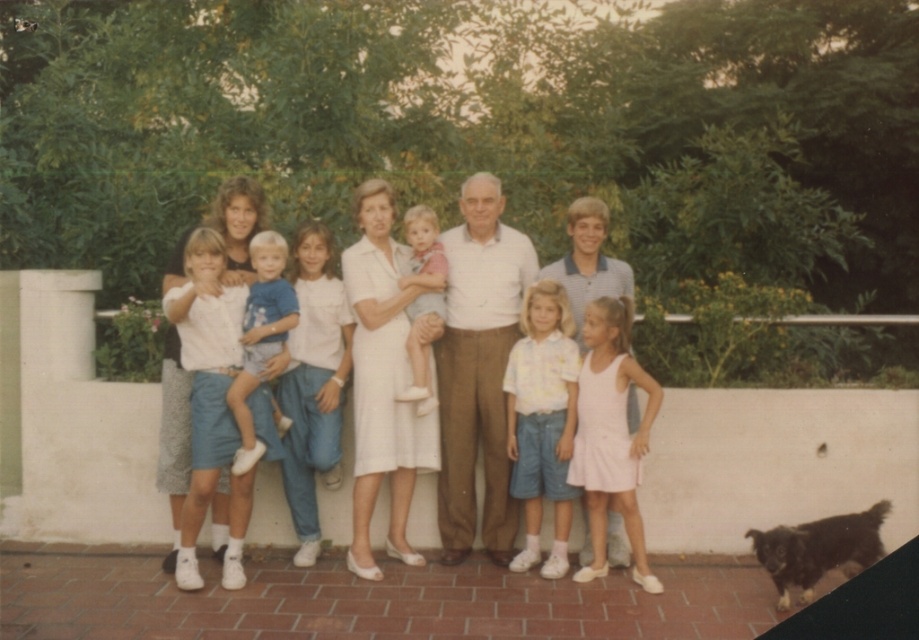
Looking at this image, you are a photographer trying to capture a clear shot of the white cotton dress at center and the white fabric dress at center. Which dress is closer to the camera?

The white cotton dress at center is closer to the camera because it is in front of the white fabric dress at center.

You are a photographer trying to capture a group photo of the family. You notice the white cotton shirt at center and the yellow floral shirt at center. Which shirt should you adjust to ensure both are visible in the frame?

The white cotton shirt at center is taller than the yellow floral shirt at center, so you should lower the white cotton shirt at center to make sure both shirts are visible in the frame.